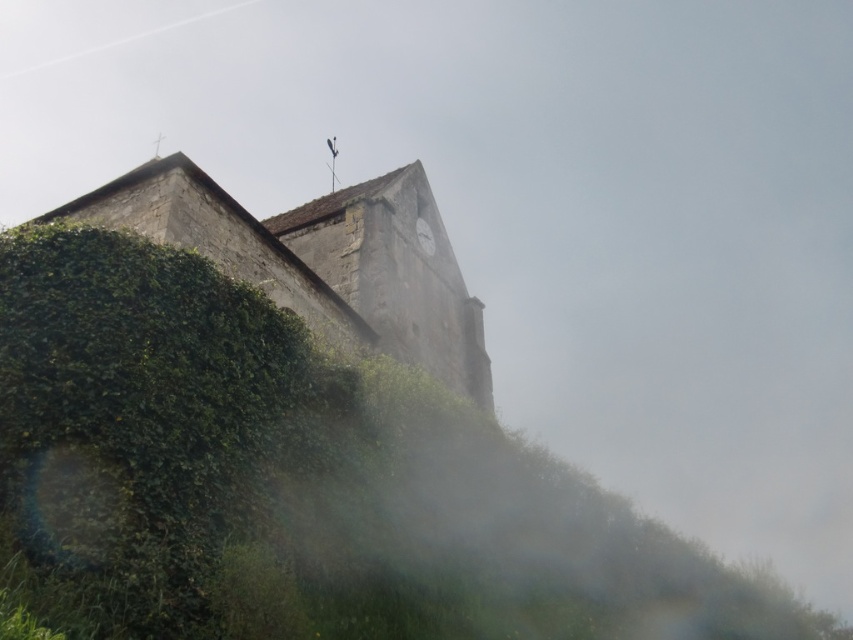
You are standing at the center of the image. Which direction should you walk to reach the green leafy hedge at left?

You should walk to the left to reach the green leafy hedge at left since it is located at the left side of the image.

Based on the photo, you are a landscape architect designing a garden path that needs to pass between the green leafy hedge at left and the stone clock tower at center. The path must be at least 1 meter wide to accommodate wheelchairs. Can the existing space between them support this requirement?

The green leafy hedge at left is thinner than the stone clock tower at center. However, the description does not provide specific measurements of the space between them. Without knowing the exact width of the gap, it is impossible to determine if it meets the 1 meter requirement. Additional measurements are needed.